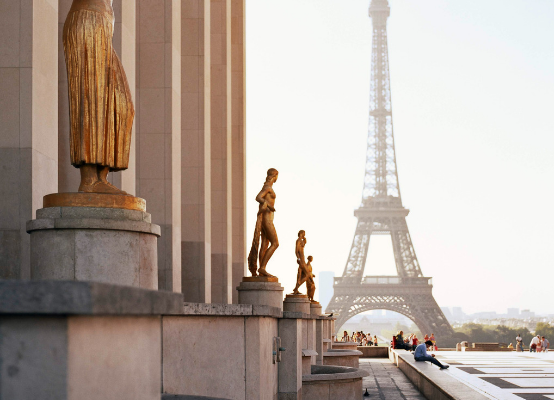
This screenshot has height=400, width=554. Find the location of `bench`. bench is located at coordinates (418, 359).